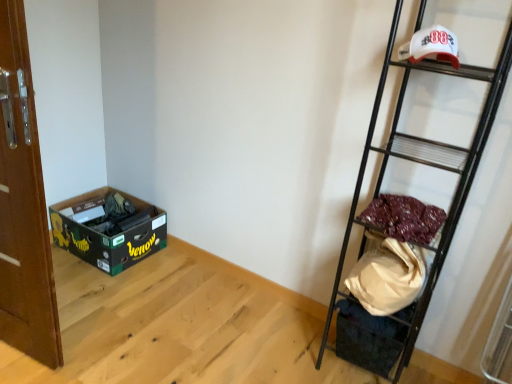
The height and width of the screenshot is (384, 512). I want to click on vacant space behind brown wooden door at left, so click(84, 297).